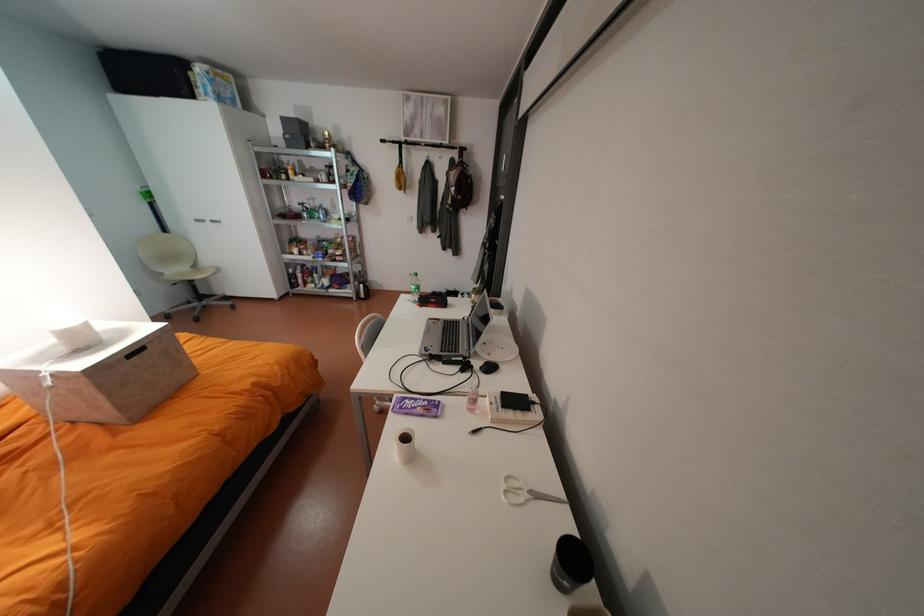
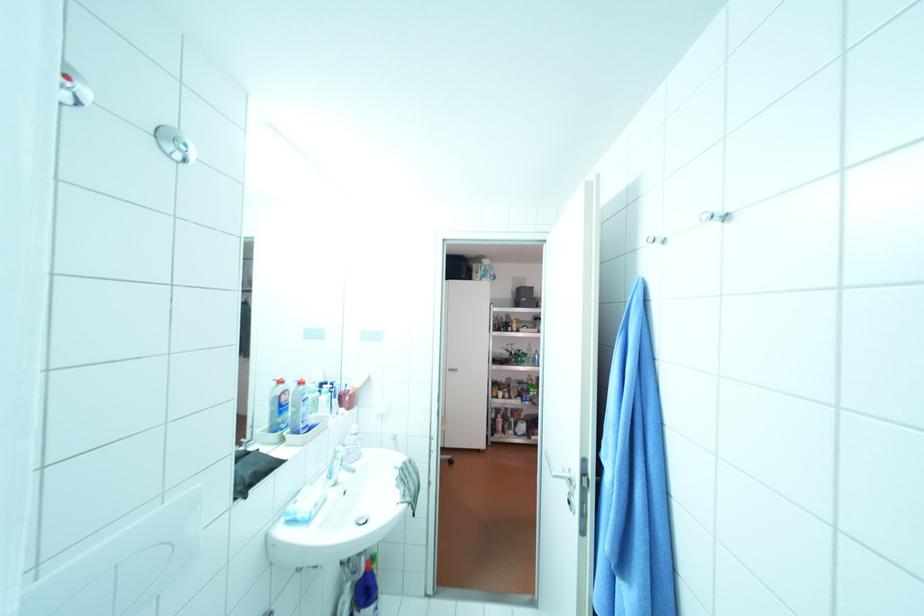
Question: Which direction would the cameraman need to move to produce the second image? Reply with the corresponding letter.

Choices:
 (A) Left
 (B) Right
 (C) Forward
 (D) Backward

Answer: (A)